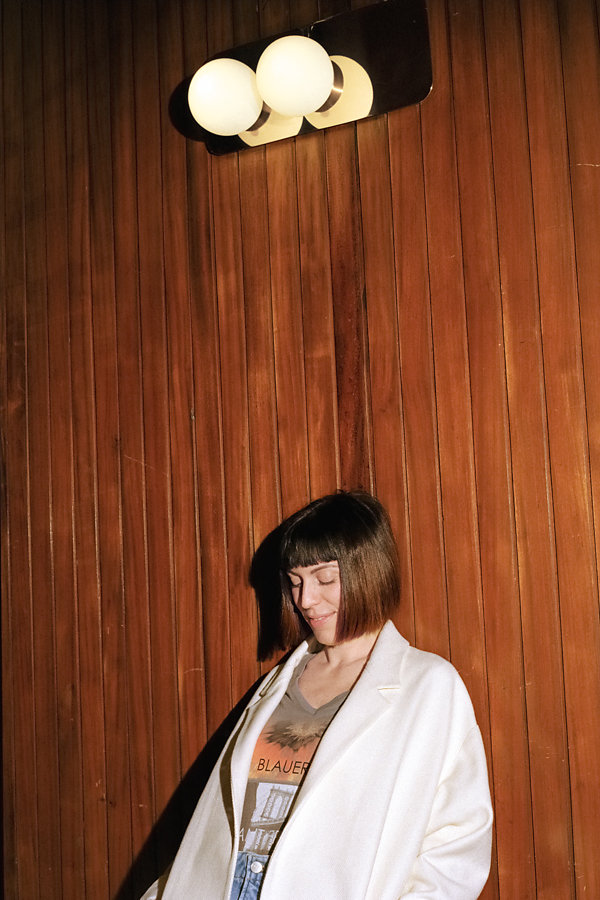
Identify the location of light wall support. (363, 34).